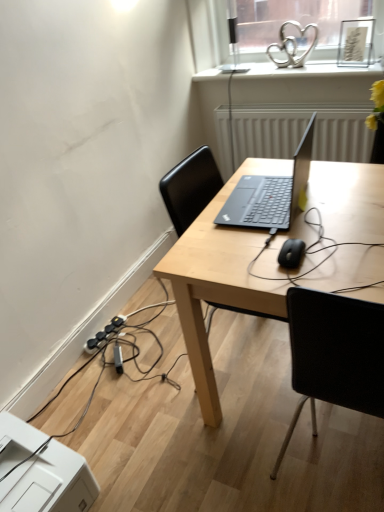
Find the location of a particular element. vacant point to the right of black matte mouse at center is located at coordinates (346, 244).